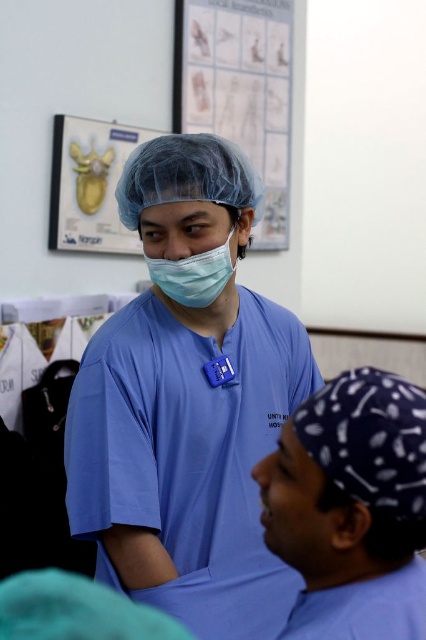
You are a patient in this medical setting and want to read the white paper poster at upper center. The matte blue scrubs at center are blocking your view. Can you move to your right to see the poster better?

The matte blue scrubs at center is to the left of the white paper poster at upper center, so if you move to your right, you will be facing the poster more directly and can see it better.

You are a medical student who needs to locate the matte blue scrubs at center for an upcoming surgery. According to the image, where exactly are they positioned?

The matte blue scrubs at center are positioned at point (187, 401).